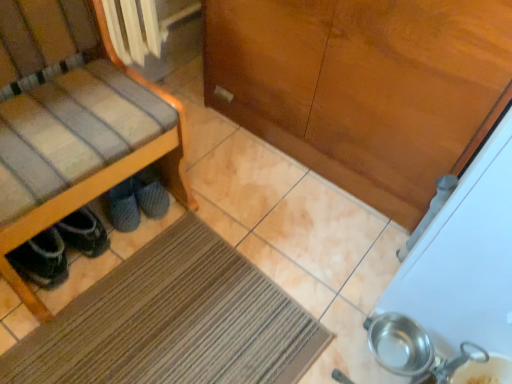
Find the location of a particular element. This screenshot has width=512, height=384. free spot to the right of gray fuzzy slippers at lower left, which is the 2th footwear from front to back is located at coordinates (206, 203).